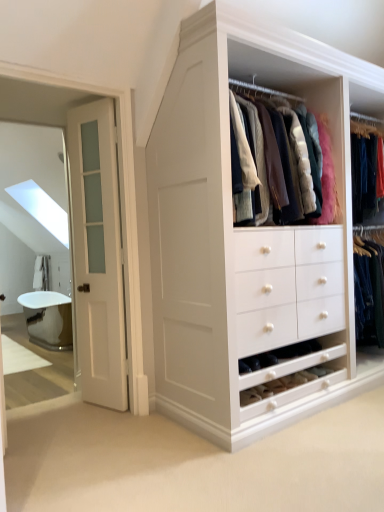
This screenshot has height=512, width=384. Identify the location of silver metallic bathtub at left. (48, 319).

The height and width of the screenshot is (512, 384). What do you see at coordinates (48, 319) in the screenshot?
I see `silver metallic bathtub at left` at bounding box center [48, 319].

Find the location of a particular element. The width and height of the screenshot is (384, 512). white frosted glass door at left is located at coordinates (97, 253).

The width and height of the screenshot is (384, 512). What do you see at coordinates (97, 253) in the screenshot? I see `white frosted glass door at left` at bounding box center [97, 253].

Where is `silver metallic bathtub at left`? The height and width of the screenshot is (512, 384). silver metallic bathtub at left is located at coordinates 48,319.

Considering the positions of objects white frosted glass door at left and silver metallic bathtub at left in the image provided, who is more to the right, white frosted glass door at left or silver metallic bathtub at left?

Positioned to the right is white frosted glass door at left.

Does white frosted glass door at left lie behind silver metallic bathtub at left?

No, white frosted glass door at left is closer to the camera.

Is point (106, 112) farther from camera compared to point (40, 297)?

No, it is not.

From the image's perspective, is white frosted glass door at left located above or below silver metallic bathtub at left?

white frosted glass door at left is situated higher than silver metallic bathtub at left in the image.

From a real-world perspective, is white frosted glass door at left positioned over silver metallic bathtub at left based on gravity?

Indeed, from a real-world perspective, white frosted glass door at left stands above silver metallic bathtub at left.

Based on the photo, does white frosted glass door at left have a greater width compared to silver metallic bathtub at left?

In fact, white frosted glass door at left might be narrower than silver metallic bathtub at left.

Who is shorter, white frosted glass door at left or silver metallic bathtub at left?

silver metallic bathtub at left.

In terms of size, does white frosted glass door at left appear bigger or smaller than silver metallic bathtub at left?

In the image, white frosted glass door at left appears to be smaller than silver metallic bathtub at left.

Is white frosted glass door at left situated inside silver metallic bathtub at left or outside?

white frosted glass door at left is not inside silver metallic bathtub at left, it's outside.

Is white frosted glass door at left not near silver metallic bathtub at left?

Indeed, white frosted glass door at left is not near silver metallic bathtub at left.

Is white frosted glass door at left oriented towards silver metallic bathtub at left?

No, white frosted glass door at left is not aimed at silver metallic bathtub at left.

Measure the distance between white frosted glass door at left and silver metallic bathtub at left.

The distance of white frosted glass door at left from silver metallic bathtub at left is 11.44 feet.

At what (x,y) coordinates should I click in order to perform the action: click on door that appears on the right of silver metallic bathtub at left. Please return your answer as a coordinate pair (x, y). The height and width of the screenshot is (512, 384). Looking at the image, I should click on (97, 253).

From the picture: Is silver metallic bathtub at left at the right side of white frosted glass door at left?

In fact, silver metallic bathtub at left is to the left of white frosted glass door at left.

Which is behind, silver metallic bathtub at left or white frosted glass door at left?

→ silver metallic bathtub at left is further away from the camera.

Is point (37, 331) positioned behind point (115, 267)?

Yes.

From the image's perspective, is silver metallic bathtub at left located beneath white frosted glass door at left?

Indeed, from the image's perspective, silver metallic bathtub at left is shown beneath white frosted glass door at left.

From a real-world perspective, is silver metallic bathtub at left on white frosted glass door at left?

Incorrect, from a real-world perspective, silver metallic bathtub at left is lower than white frosted glass door at left.

Which of these two, silver metallic bathtub at left or white frosted glass door at left, is wider?

silver metallic bathtub at left is wider.

Which of these two, silver metallic bathtub at left or white frosted glass door at left, stands taller?

white frosted glass door at left.

Which of these two, silver metallic bathtub at left or white frosted glass door at left, is smaller?

white frosted glass door at left is smaller.

Is silver metallic bathtub at left not within white frosted glass door at left?

silver metallic bathtub at left lies outside white frosted glass door at left's area.

Looking at this image, are silver metallic bathtub at left and white frosted glass door at left beside each other?

They are not placed beside each other.

Is silver metallic bathtub at left oriented towards white frosted glass door at left?

No.

You are a GUI agent. You are given a task and a screenshot of the screen. Output one action in this format:
    pyautogui.click(x=<x>, y=<y>)
    Task: Click on the bath below the white frosted glass door at left (from a real-world perspective)
    Image resolution: width=384 pixels, height=512 pixels.
    Given the screenshot: What is the action you would take?
    pyautogui.click(x=48, y=319)

The height and width of the screenshot is (512, 384). Find the location of `bath located behind the white frosted glass door at left`. bath located behind the white frosted glass door at left is located at coordinates (48, 319).

Identify the location of door in front of the silver metallic bathtub at left. 97,253.